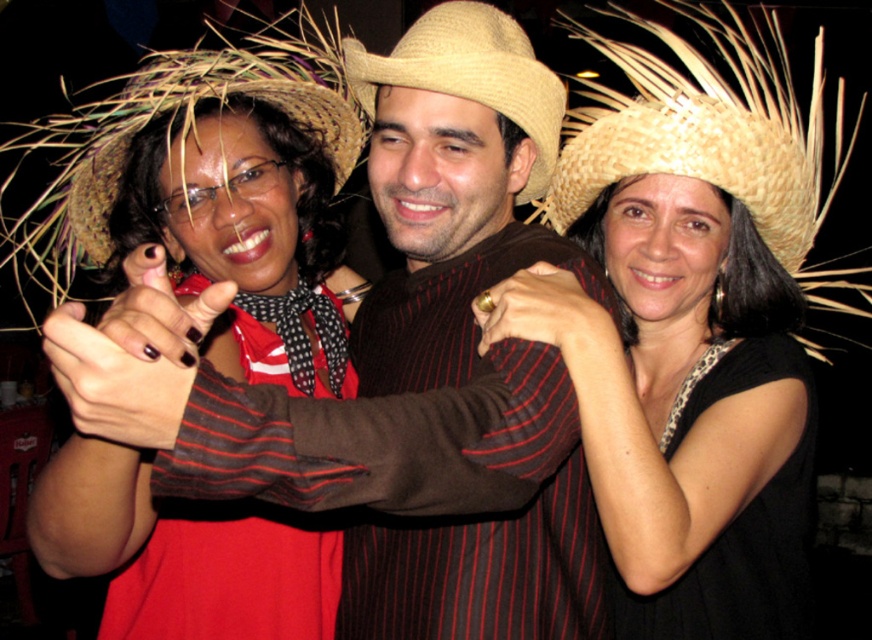
Question: In this image, where is matte brown shirt at center located relative to black knitted dress at right?

Choices:
 (A) left
 (B) right

Answer: (A)

Question: Which object is positioned farthest from the natural straw hat at upper left?

Choices:
 (A) matte brown shirt at center
 (B) matte straw hat at upper left
 (C) black matte dress at center
 (D) straw hat at center

Answer: (C)

Question: Among these points, which one is nearest to the camera?

Choices:
 (A) (387, 353)
 (B) (791, 516)
 (C) (175, 77)
 (D) (492, 97)

Answer: (D)

Question: Can you confirm if matte brown shirt at center is smaller than straw hat at center?

Choices:
 (A) yes
 (B) no

Answer: (B)

Question: Which object is the farthest from the natural straw hat at upper left?

Choices:
 (A) straw hat at center
 (B) natural straw hat at upper right
 (C) black matte dress at center

Answer: (B)

Question: Is natural straw hat at upper left to the right of black knitted dress at right from the viewer's perspective?

Choices:
 (A) yes
 (B) no

Answer: (B)